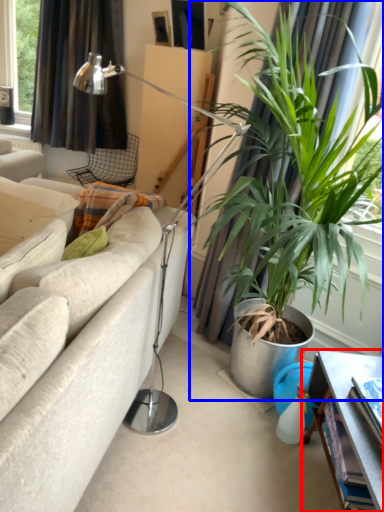
Question: Which of the following is the closest to the observer, table (highlighted by a red box) or houseplant (highlighted by a blue box)?

Choices:
 (A) table
 (B) houseplant

Answer: (A)